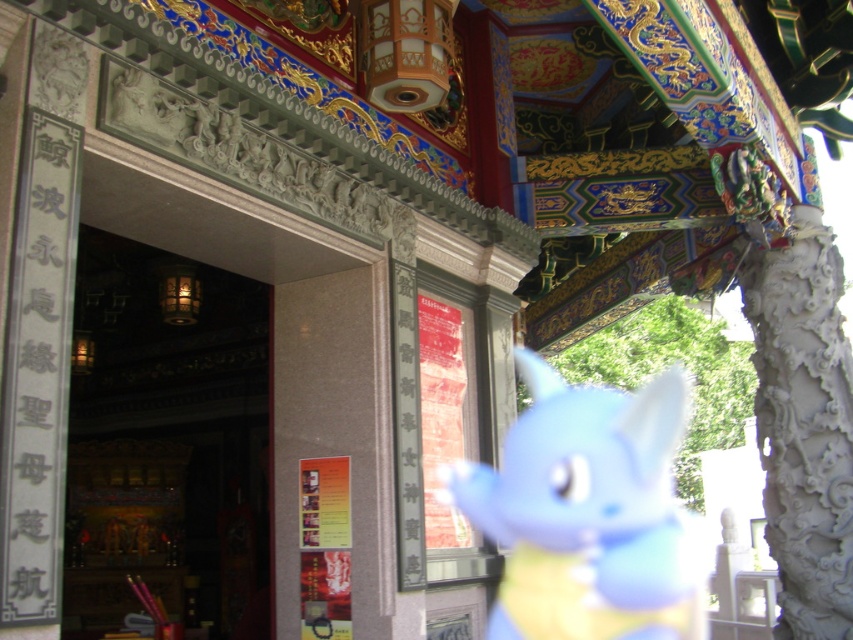
Question: Considering the relative positions of wooden carved door at center and blue plush toy at center in the image provided, where is wooden carved door at center located with respect to blue plush toy at center?

Choices:
 (A) left
 (B) right

Answer: (A)

Question: Which of the following is the farthest from the observer?

Choices:
 (A) wooden carved door at center
 (B) blue plush toy at center

Answer: (A)

Question: Which point is farther to the camera?

Choices:
 (A) (584, 502)
 (B) (86, 499)

Answer: (A)

Question: Is wooden carved door at center above blue plush toy at center?

Choices:
 (A) no
 (B) yes

Answer: (B)

Question: Can you confirm if wooden carved door at center is thinner than blue plush toy at center?

Choices:
 (A) yes
 (B) no

Answer: (A)